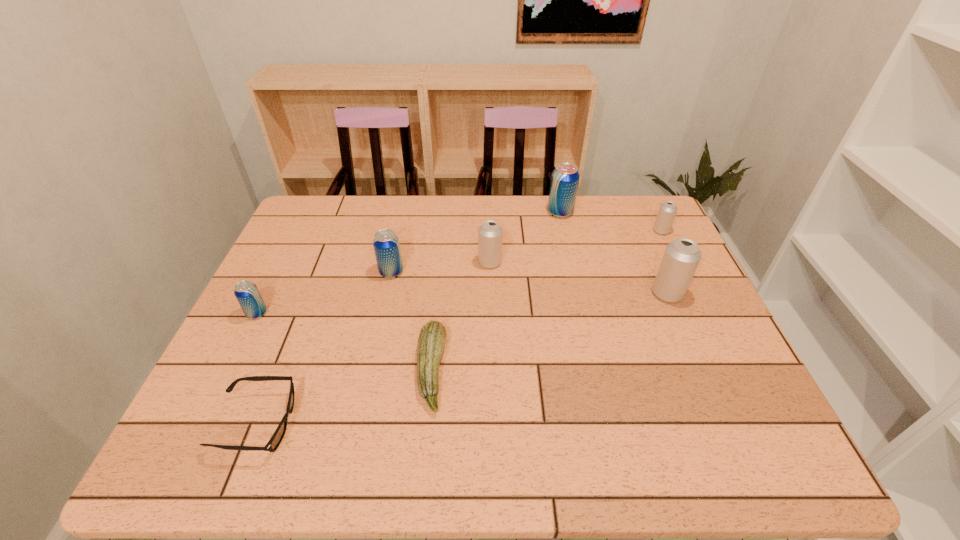
Image resolution: width=960 pixels, height=540 pixels. I want to click on free point between the seventh tallest object and the second object from left to right, so click(x=344, y=397).

Locate an element on the screen. The height and width of the screenshot is (540, 960). free space between the second biggest white beer can and the fifth farthest object is located at coordinates (579, 278).

At what (x,y) coordinates should I click in order to perform the action: click on vacant space that is in between the third beer can from right to left and the biggest white beer can. Please return your answer as a coordinate pair (x, y). This screenshot has width=960, height=540. Looking at the image, I should click on (613, 253).

Choose which object is the second nearest neighbor to the fifth object from right to left. Please provide its 2D coordinates. Your answer should be formatted as a tuple, i.e. [(x, y)], where the tuple contains the x and y coordinates of a point satisfying the conditions above.

[(275, 440)]

Find the location of a particular element. The image size is (960, 540). the second closest object to the leftmost blue beer can is located at coordinates (386, 245).

Find the location of a particular element. beer can object that ranks as the fourth closest to the seventh nearest object is located at coordinates (386, 245).

Choose which beer can is the second nearest neighbor to the smallest white beer can. Please provide its 2D coordinates. Your answer should be formatted as a tuple, i.e. [(x, y)], where the tuple contains the x and y coordinates of a point satisfying the conditions above.

[(565, 177)]

Identify which blue beer can is the second closest to the fifth farthest object. Please provide its 2D coordinates. Your answer should be formatted as a tuple, i.e. [(x, y)], where the tuple contains the x and y coordinates of a point satisfying the conditions above.

[(386, 245)]

Find the location of a particular element. blue beer can that stands as the second closest to the fifth farthest object is located at coordinates (386, 245).

This screenshot has width=960, height=540. In order to click on the closest white beer can relative to the fifth farthest beer can in this screenshot , I will do `click(667, 211)`.